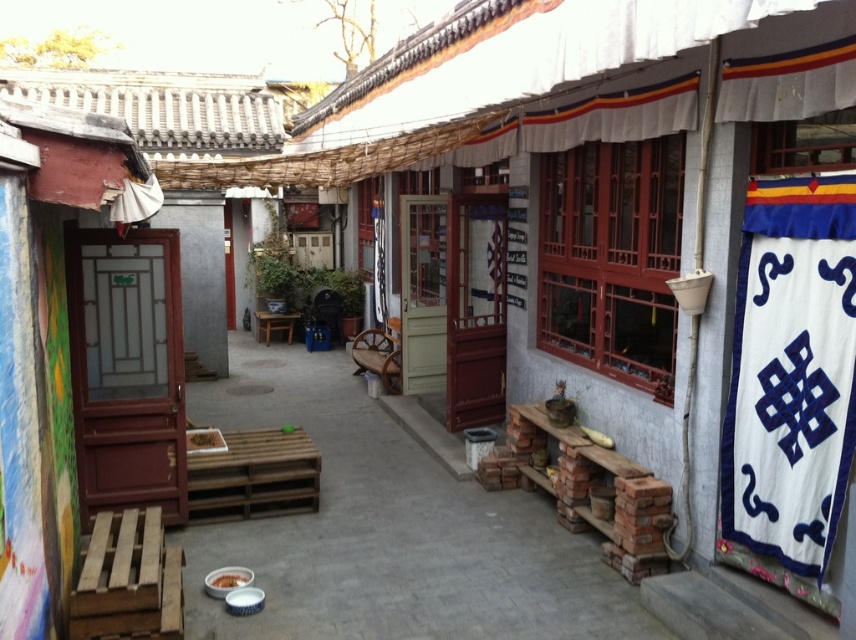
Can you confirm if white fabric banner at right is thinner than wooden stool at center?

Yes.

Does white fabric banner at right lie behind wooden stool at center?

That is False.

The width and height of the screenshot is (856, 640). I want to click on white fabric banner at right, so click(x=791, y=378).